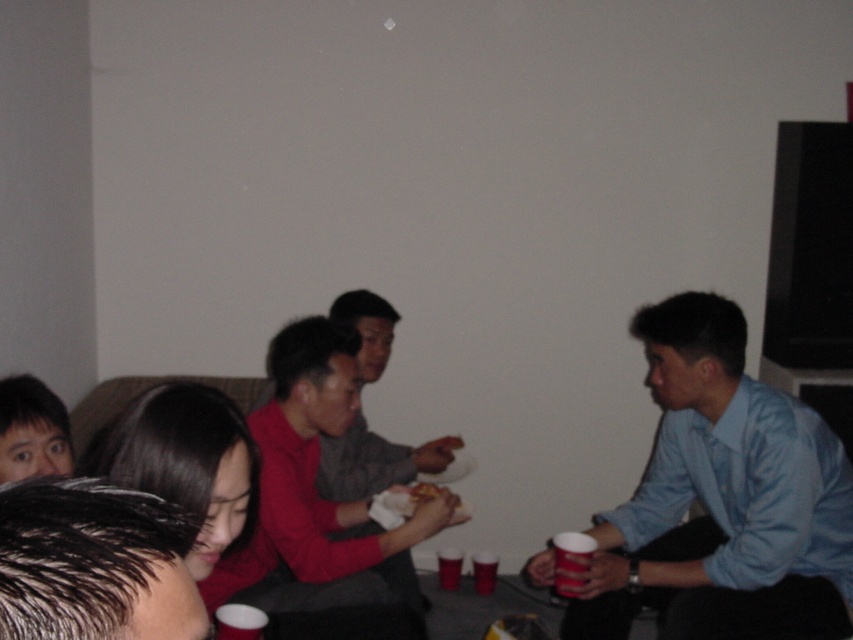
In the scene shown: You are standing at the origin of the coordinate system in the living room. There are two points marked in the image, point (410, 595) and point (426, 499). If you want to walk towards the point that is further away from you, which point should you head towards?

Point (410, 595) is behind point (426, 499), so you should head towards point (410, 595) as it is further away from your current position.

You are a photographer trying to capture a closeup of both the red matte shirt at center and the golden crispy chicken at center. Given that the camera can only focus on one object at a time, which object should you focus on first to ensure it appears larger in the photo?

The red matte shirt at center is larger in size than the golden crispy chicken at center, so you should focus on the red matte shirt at center first to ensure it appears larger in the photo.